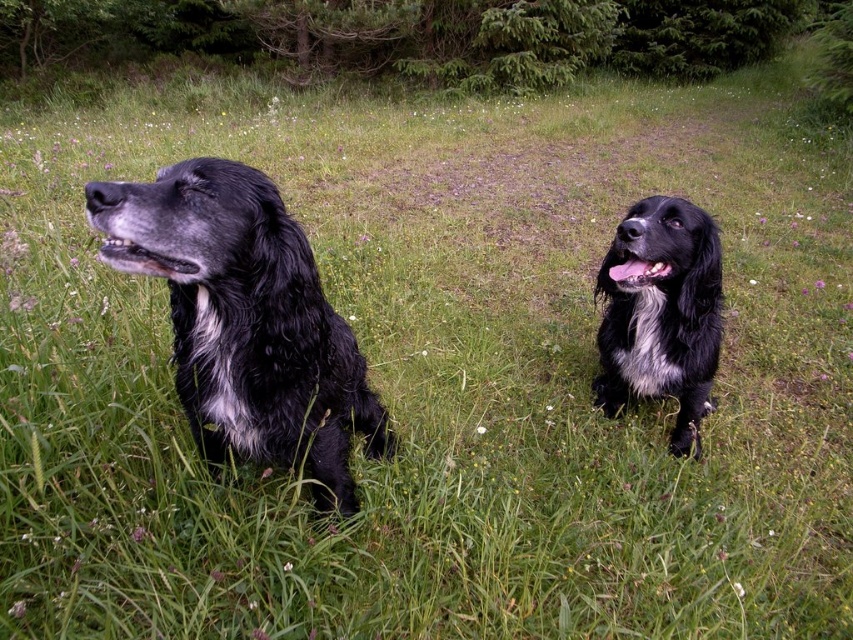
Question: Does shiny black fur at left have a larger size compared to black fluffy dog at right?

Choices:
 (A) no
 (B) yes

Answer: (A)

Question: Is shiny black fur at left above black fluffy dog at right?

Choices:
 (A) no
 (B) yes

Answer: (A)

Question: Which point appears closest to the camera in this image?

Choices:
 (A) (184, 397)
 (B) (630, 369)

Answer: (A)

Question: Is shiny black fur at left smaller than black fluffy dog at right?

Choices:
 (A) no
 (B) yes

Answer: (B)